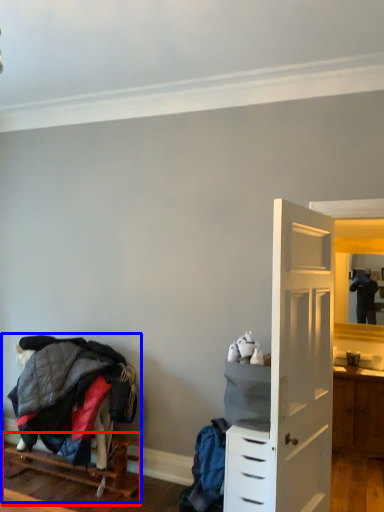
Question: Which object appears closest to the camera in this image, furniture (highlighted by a red box) or bunk bed (highlighted by a blue box)?

Choices:
 (A) furniture
 (B) bunk bed

Answer: (A)